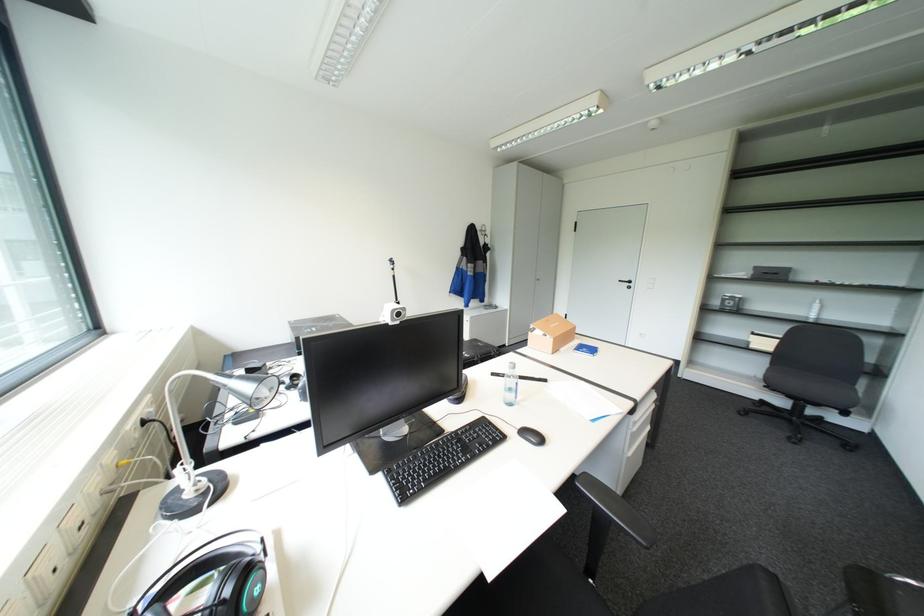
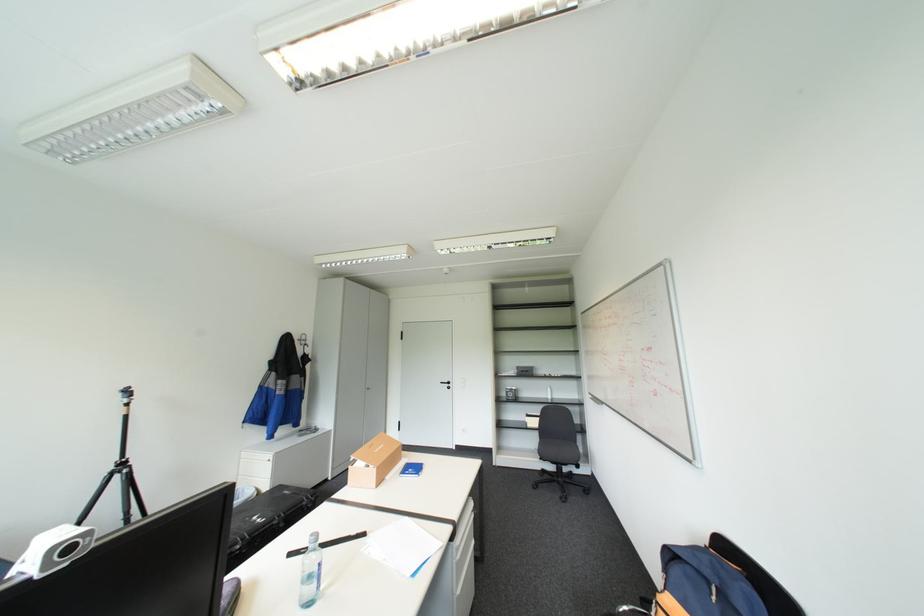
Find the pixel in the second image that matches [775,363] in the first image.

(546, 438)